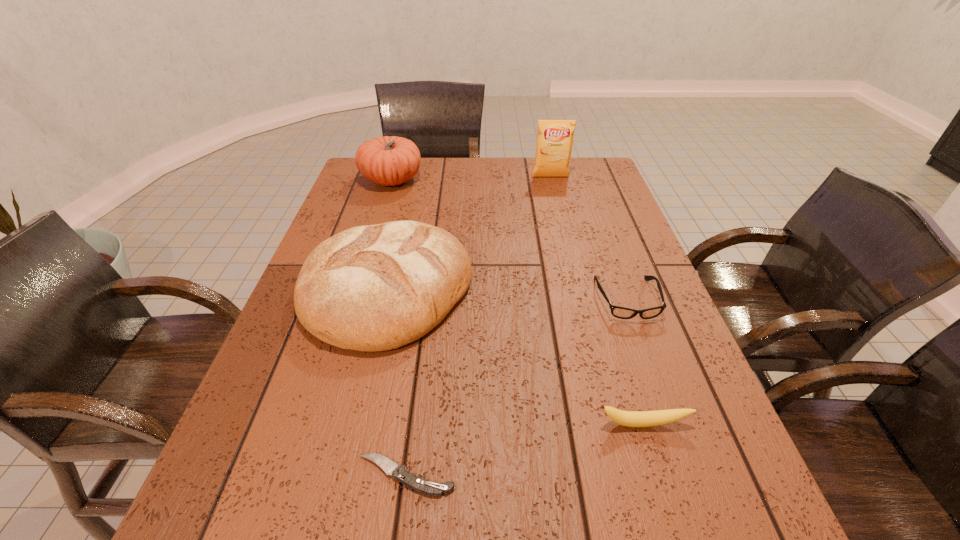
Identify the location of spectacles located at the right edge. The image size is (960, 540). (619, 312).

Locate an element on the screen. object that is at the far left corner is located at coordinates (390, 160).

Image resolution: width=960 pixels, height=540 pixels. I want to click on object present at the far right corner, so click(x=555, y=137).

The image size is (960, 540). I want to click on vacant space at the right edge, so click(x=646, y=372).

This screenshot has width=960, height=540. What are the coordinates of `free space between the spectacles and the pumpkin` in the screenshot? It's located at (509, 240).

Identify the location of free spot between the fifth tallest object and the pumpkin. The width and height of the screenshot is (960, 540). (509, 240).

You are a GUI agent. You are given a task and a screenshot of the screen. Output one action in this format:
    pyautogui.click(x=<x>, y=<y>)
    Task: Click on the vacant area between the fifth farthest object and the nearest object
    The image size is (960, 540).
    Given the screenshot: What is the action you would take?
    pos(524,449)

This screenshot has width=960, height=540. In order to click on blank region between the bread and the shortest object in this screenshot , I will do `click(396, 383)`.

This screenshot has height=540, width=960. Identify the location of free space between the banana and the bread. (515, 357).

This screenshot has height=540, width=960. I want to click on empty space between the banana and the second shortest object, so point(635,362).